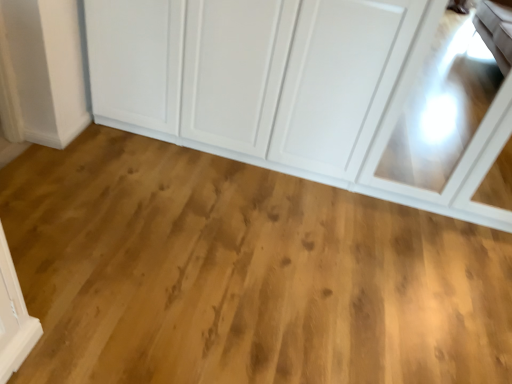
At what (x,y) coordinates should I click in order to perform the action: click on vacant area in front of white glossy cupboard at upper center. Please return your answer as a coordinate pair (x, y). The image size is (512, 384). Looking at the image, I should click on (288, 261).